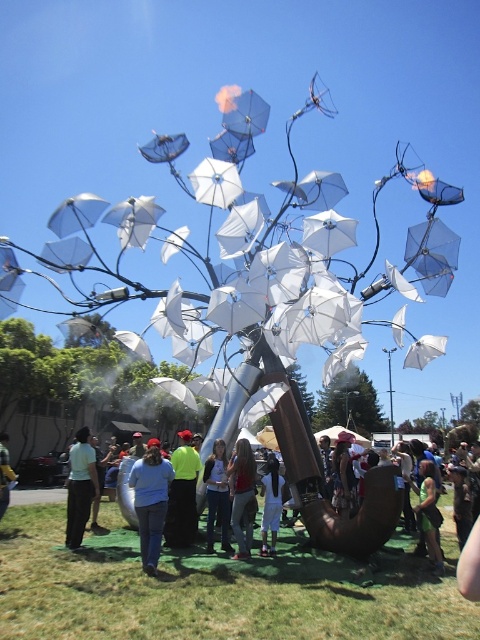
You are standing in front of the large umbrella tree installation. You notice a matte black shirt at center. Based on its position coordinates, can you determine if it is placed exactly at the center of the installation?

The matte black shirt at center is located at coordinates point (x=216, y=496), which is not exactly at the center of the installation since the exact center would be at point (x=240, y=320).

You are a photographer planning to capture the artistic umbrella tree installation. You notice a person wearing a light blue shirt at center and light blue jeans at lower left. Which clothing item is positioned higher in the frame?

The light blue shirt at center is taller than the light blue jeans at lower left, so the shirt is positioned higher in the frame.